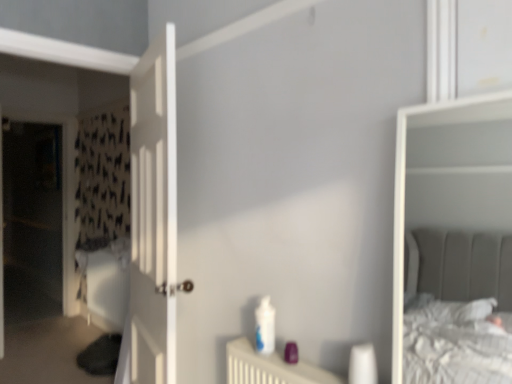
Question: Is white glossy bottle at center positioned far away from white wooden door at left?

Choices:
 (A) yes
 (B) no

Answer: (B)

Question: Is white glossy bottle at center located outside white wooden door at left?

Choices:
 (A) yes
 (B) no

Answer: (A)

Question: From the image's perspective, would you say white glossy bottle at center is positioned over white wooden door at left?

Choices:
 (A) yes
 (B) no

Answer: (B)

Question: From a real-world perspective, is white glossy bottle at center on top of white wooden door at left?

Choices:
 (A) no
 (B) yes

Answer: (A)

Question: Is white glossy bottle at center smaller than white wooden door at left?

Choices:
 (A) yes
 (B) no

Answer: (A)

Question: Is point click(x=268, y=322) closer or farther from the camera than point click(x=146, y=142)?

Choices:
 (A) farther
 (B) closer

Answer: (B)

Question: Would you say white glossy bottle at center is inside or outside white wooden door at left?

Choices:
 (A) inside
 (B) outside

Answer: (B)

Question: From their relative heights in the image, would you say white glossy bottle at center is taller or shorter than white wooden door at left?

Choices:
 (A) short
 (B) tall

Answer: (A)

Question: From the image's perspective, relative to white wooden door at left, is white glossy bottle at center above or below?

Choices:
 (A) below
 (B) above

Answer: (A)

Question: Is white glossy bottle at center taller or shorter than transparent plastic screen door at left?

Choices:
 (A) short
 (B) tall

Answer: (A)

Question: Considering the positions of point (265, 339) and point (40, 127), is point (265, 339) closer or farther from the camera than point (40, 127)?

Choices:
 (A) farther
 (B) closer

Answer: (B)

Question: Is white glossy bottle at center wider or thinner than transparent plastic screen door at left?

Choices:
 (A) thin
 (B) wide

Answer: (A)

Question: In the image, is white glossy bottle at center positioned in front of or behind transparent plastic screen door at left?

Choices:
 (A) front
 (B) behind

Answer: (A)

Question: From the image's perspective, relative to white glossy bottle at center, is transparent plastic screen door at left above or below?

Choices:
 (A) above
 (B) below

Answer: (A)

Question: Is transparent plastic screen door at left in front of or behind white glossy bottle at center in the image?

Choices:
 (A) behind
 (B) front

Answer: (A)